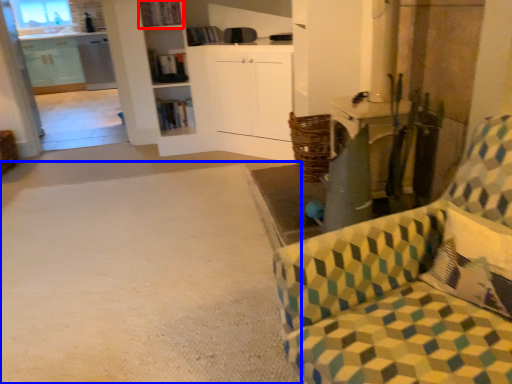
Question: Which object is closer to the camera taking this photo, shelf (highlighted by a red box) or plain (highlighted by a blue box)?

Choices:
 (A) shelf
 (B) plain

Answer: (B)